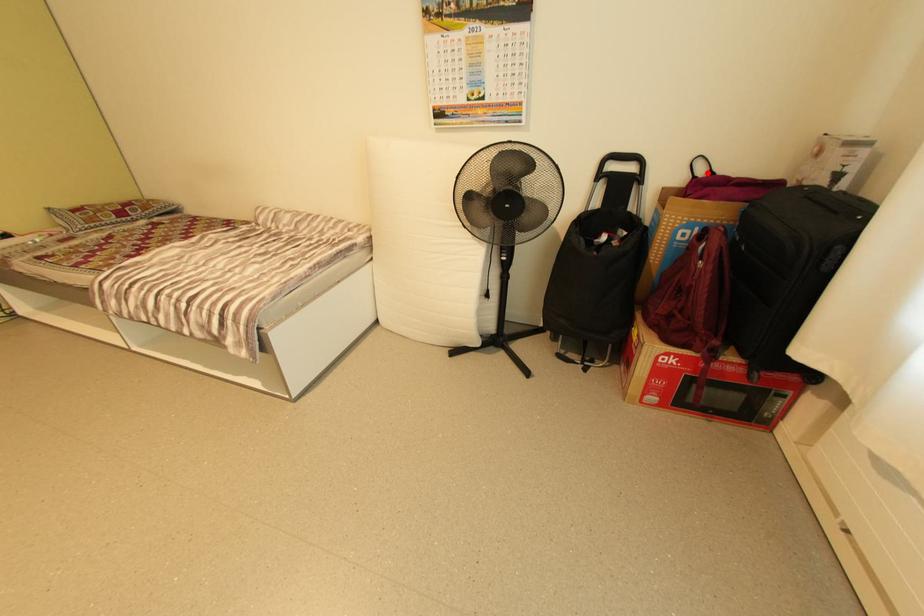
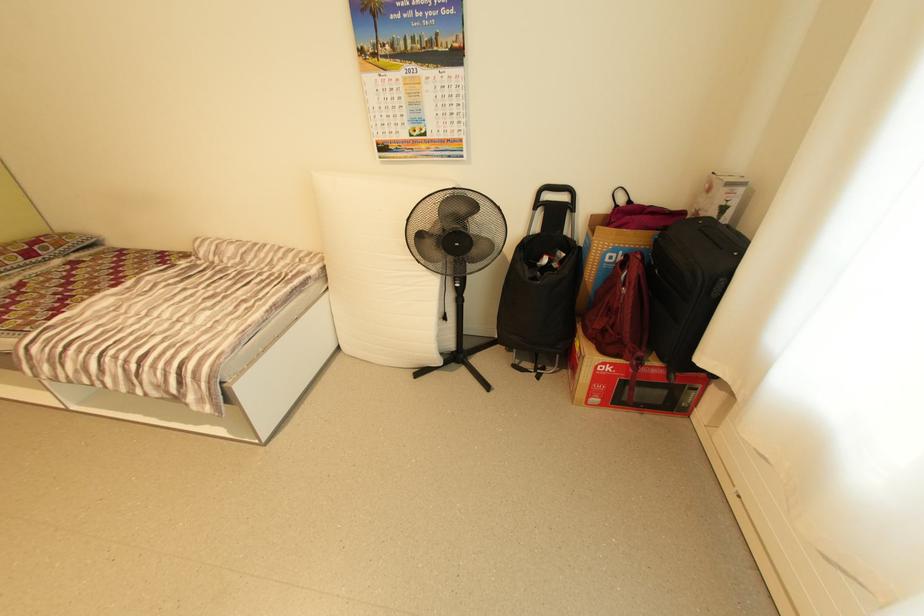
Find the pixel in the second image that matches the highlighted location in the first image.

(628, 201)